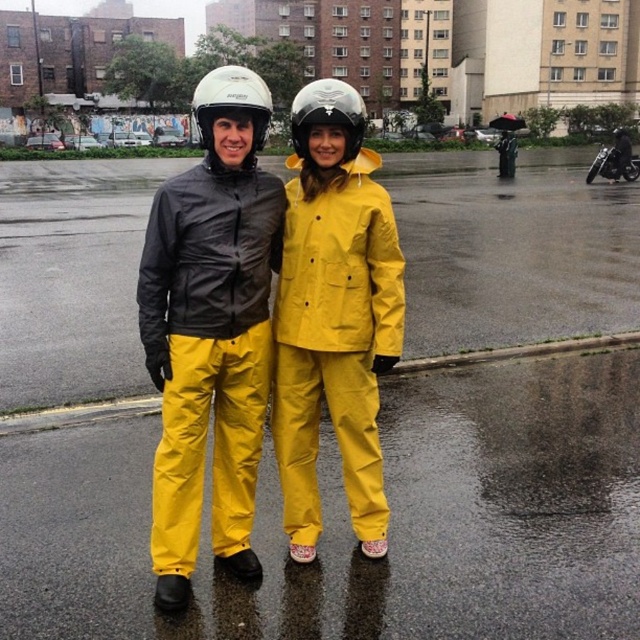
Question: Which is farther from the shiny black motorcycle at upper right?

Choices:
 (A) yellow waterproof raincoat at center
 (B) white matte helmet at upper center

Answer: (A)

Question: Does yellow waterproof raincoat at center have a larger size compared to shiny black motorcycle at upper right?

Choices:
 (A) no
 (B) yes

Answer: (A)

Question: Which of the following is the closest to the observer?

Choices:
 (A) shiny black motorcycle at upper right
 (B) yellow matte rain suit at center

Answer: (B)

Question: Based on their relative distances, which object is farther from the shiny black motorcycle at upper right?

Choices:
 (A) white matte helmet at upper center
 (B) yellow waterproof raincoat at center
 (C) white matte helmet at center

Answer: (B)

Question: Is the position of white matte helmet at center less distant than that of white matte helmet at upper center?

Choices:
 (A) yes
 (B) no

Answer: (B)

Question: In this image, where is yellow matte rain suit at center located relative to shiny black motorcycle at upper right?

Choices:
 (A) left
 (B) right

Answer: (A)